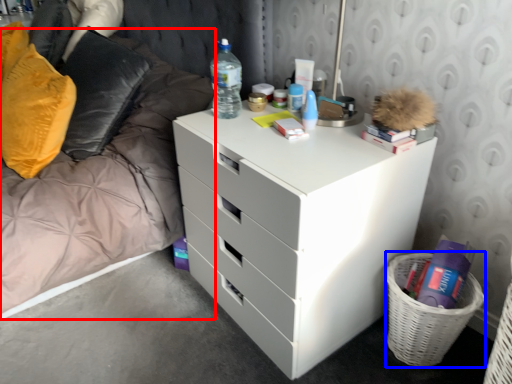
Question: Among these objects, which one is farthest to the camera, bed frame (highlighted by a red box) or basket (highlighted by a blue box)?

Choices:
 (A) bed frame
 (B) basket

Answer: (B)